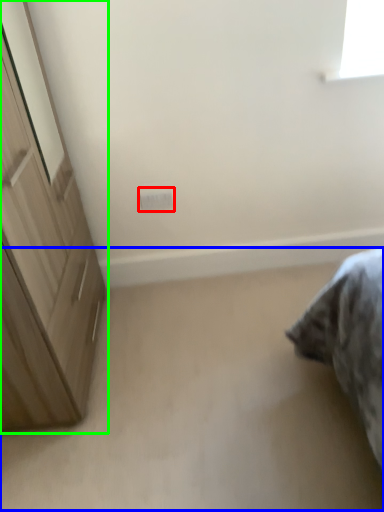
Question: Based on their relative distances, which object is nearer to electric outlet (highlighted by a red box)? Choose from plain (highlighted by a blue box) and cupboard (highlighted by a green box).

Choices:
 (A) plain
 (B) cupboard

Answer: (B)